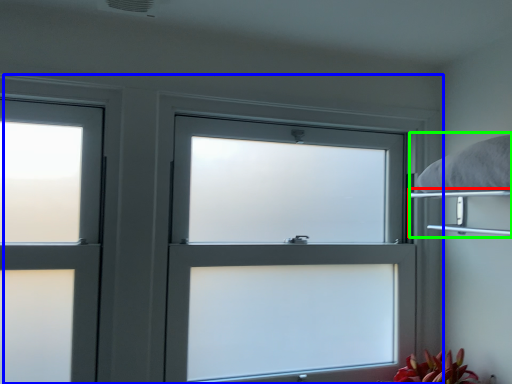
Question: Considering the real-world distances, which object is closest to shelf (highlighted by a red box)? window (highlighted by a blue box) or bed (highlighted by a green box).

Choices:
 (A) window
 (B) bed

Answer: (B)